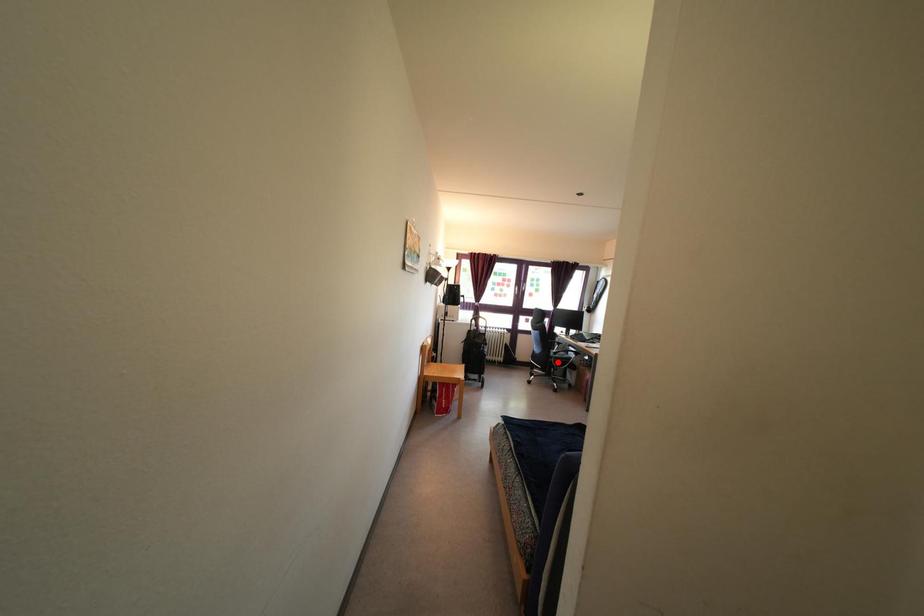
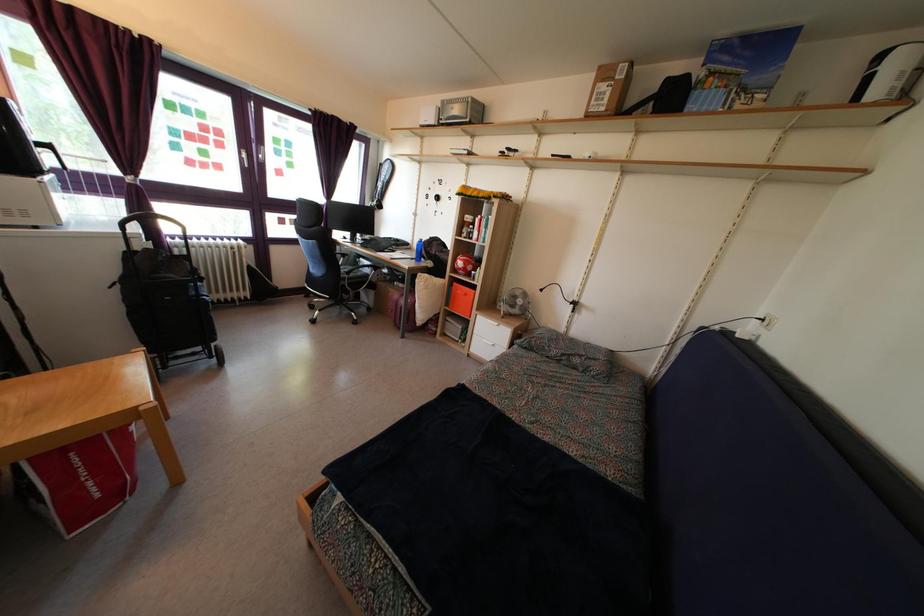
Locate, in the second image, the point that corresponds to the highlighted location in the first image.

(350, 282)